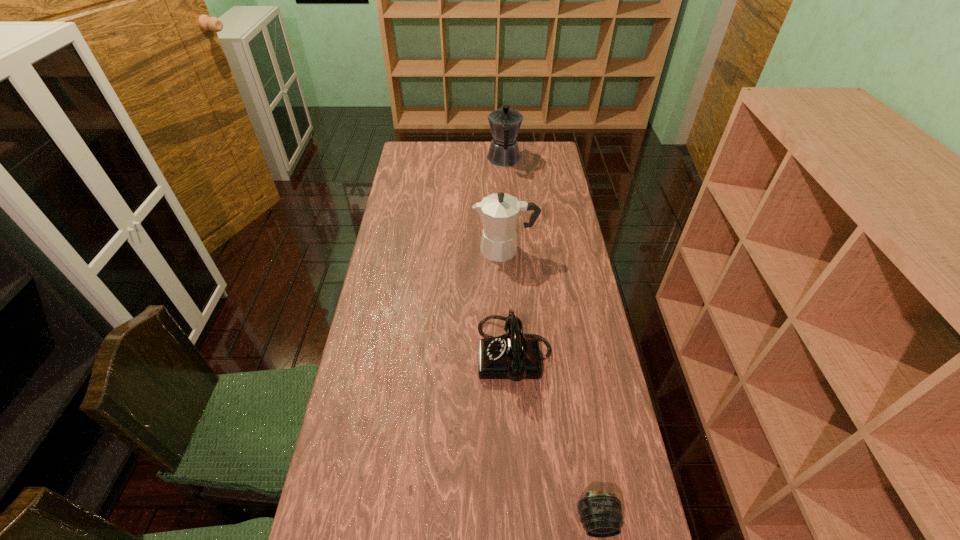
Choose which object is the second nearest neighbor to the second farthest object. Please provide its 2D coordinates. Your answer should be formatted as a tuple, i.e. [(x, y)], where the tuple contains the x and y coordinates of a point satisfying the conditions above.

[(505, 123)]